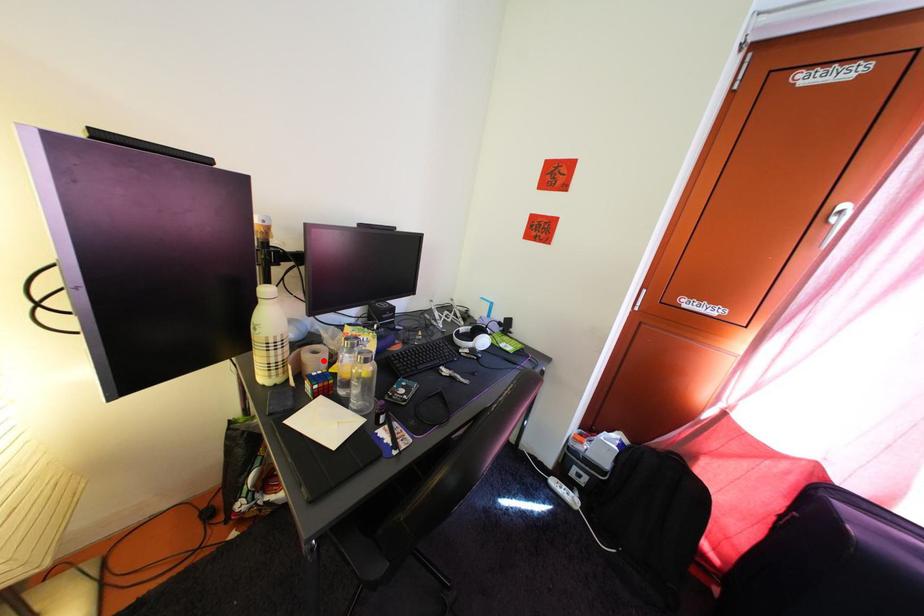
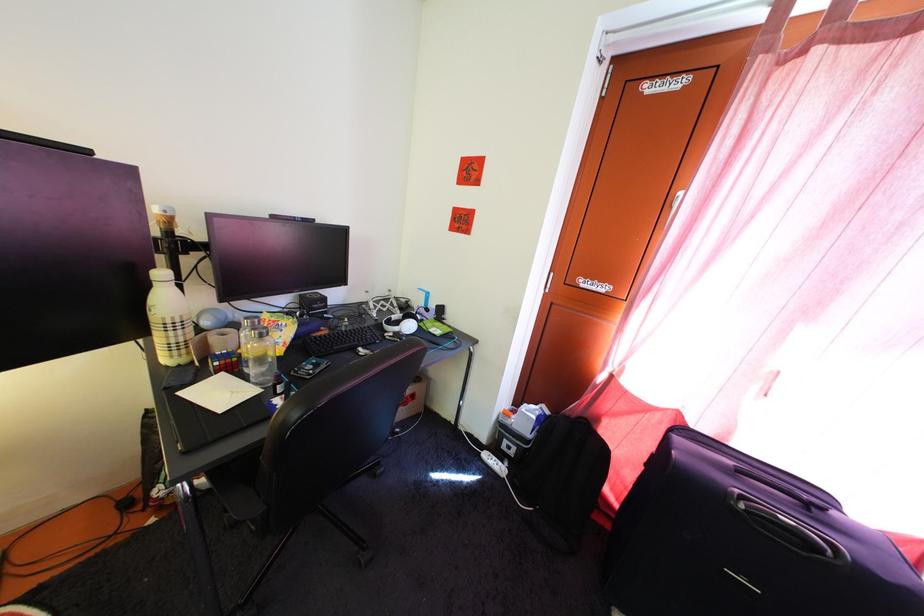
In the second image, find the point that corresponds to the highlighted location in the first image.

(233, 342)